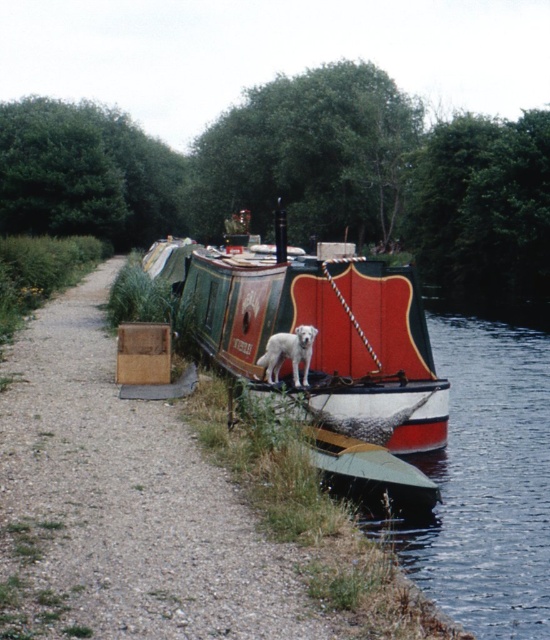
Question: Does polished wood barge at center lie behind white fur dog at center?

Choices:
 (A) no
 (B) yes

Answer: (B)

Question: Which point is closer to the camera taking this photo?

Choices:
 (A) (280, 312)
 (B) (272, 337)

Answer: (B)

Question: Can you confirm if polished wood barge at center is positioned above white fur dog at center?

Choices:
 (A) yes
 (B) no

Answer: (A)

Question: Is polished wood barge at center to the right of white fur dog at center from the viewer's perspective?

Choices:
 (A) no
 (B) yes

Answer: (A)